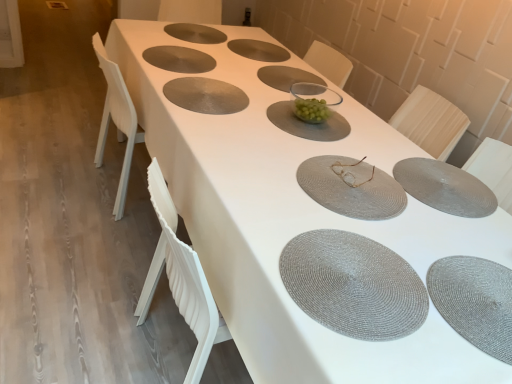
The width and height of the screenshot is (512, 384). What are the coordinates of `vacant position to the left of matte gray placemat at center, which is counted as the third tableware, starting from the bottom` in the screenshot? It's located at (x=255, y=161).